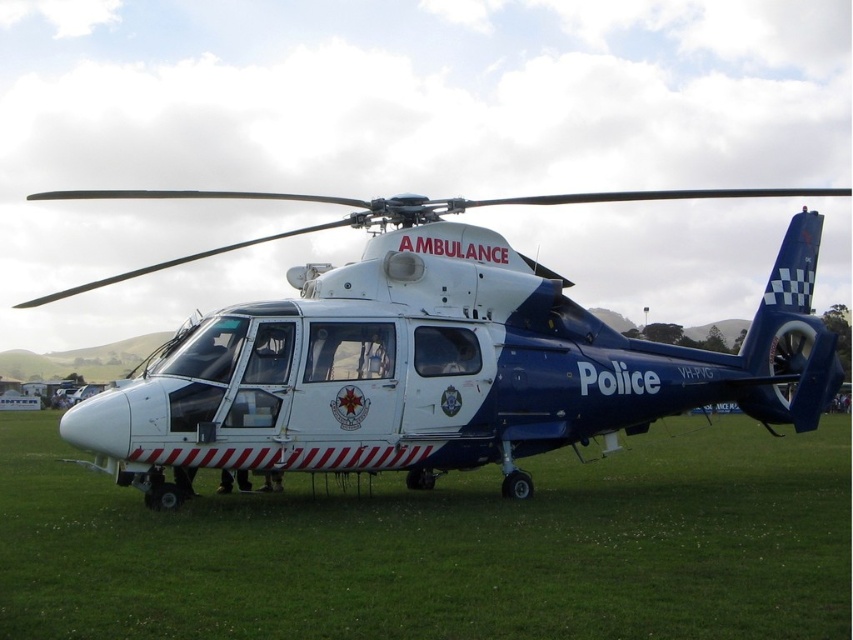
Question: Is green grass at lower center to the right of white glossy helicopter at center from the viewer's perspective?

Choices:
 (A) yes
 (B) no

Answer: (A)

Question: Does green grass at lower center appear on the left side of white glossy helicopter at center?

Choices:
 (A) no
 (B) yes

Answer: (A)

Question: Is green grass at lower center above white glossy helicopter at center?

Choices:
 (A) yes
 (B) no

Answer: (B)

Question: Among these points, which one is farthest from the camera?

Choices:
 (A) (20, 449)
 (B) (91, 442)

Answer: (A)

Question: Which object appears closest to the camera in this image?

Choices:
 (A) green grass at lower center
 (B) white glossy helicopter at center

Answer: (A)